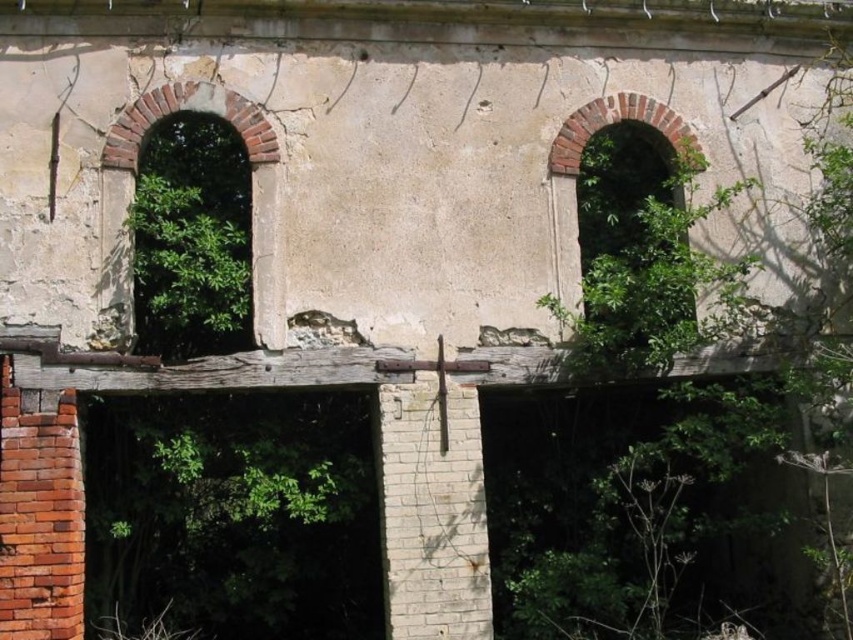
Consider the image. Which is more to the right, green leafy tree at left or brick textured window at left?

From the viewer's perspective, brick textured window at left appears more on the right side.

Who is taller, green leafy tree at left or brick textured window at left?

Standing taller between the two is brick textured window at left.

Is point (227, 337) closer to viewer compared to point (198, 100)?

No.

At what (x,y) coordinates should I click in order to perform the action: click on green leafy tree at left. Please return your answer as a coordinate pair (x, y). The height and width of the screenshot is (640, 853). Looking at the image, I should click on (190, 262).